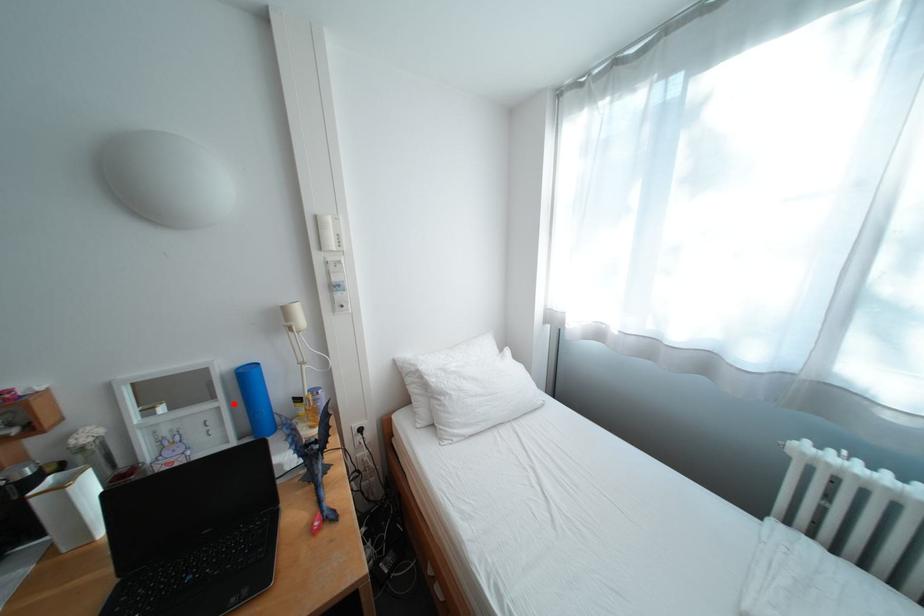
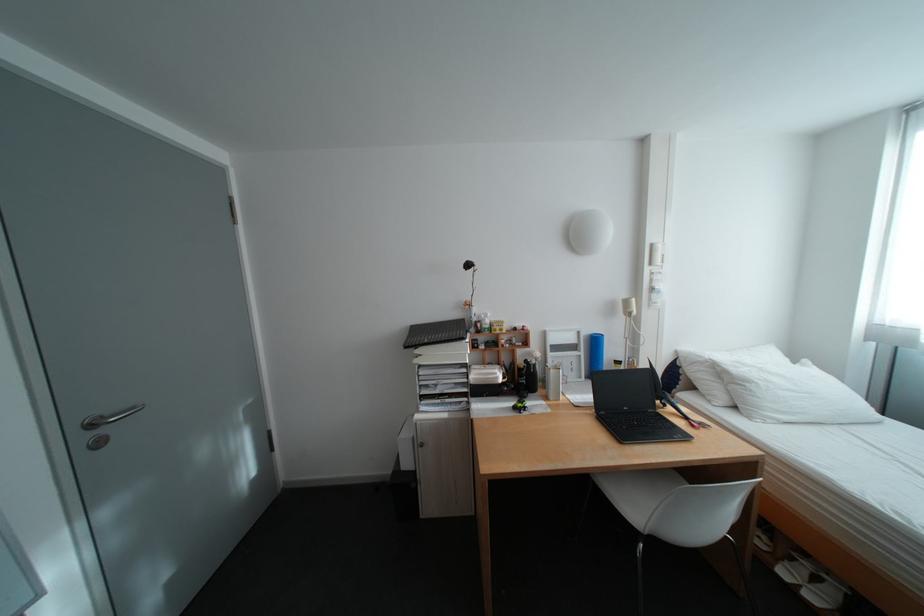
Question: I am providing you with two images of the same scene from different viewpoints. Given a red point in image1, look at the same physical point in image2. Is it:

Choices:
 (A) Closer to the viewpoint
 (B) Farther from the viewpoint

Answer: (B)